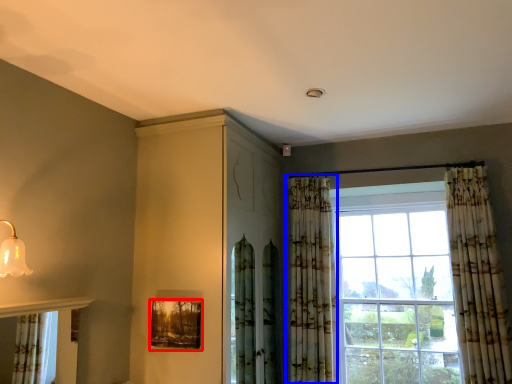
Question: Which object is further to the camera taking this photo, picture frame (highlighted by a red box) or curtain (highlighted by a blue box)?

Choices:
 (A) picture frame
 (B) curtain

Answer: (B)